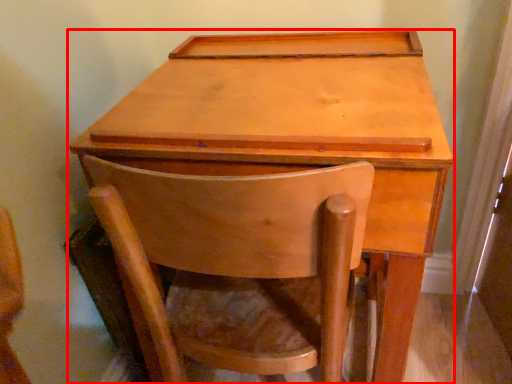
Question: From the image's perspective, what is the correct spatial relationship of table (annotated by the red box) in relation to chair?

Choices:
 (A) below
 (B) above

Answer: (B)